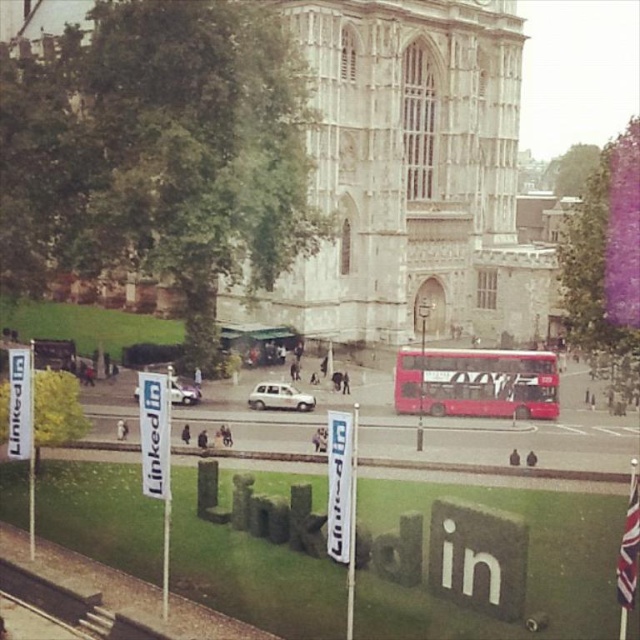
You are a delivery person trying to park your white matte car at center between two vehicles. The space between the silver metallic van at center and another vehicle is 1.8 meters. Can your car fit?

The white matte car at center is thinner than the silver metallic van at center. Since the space between the vehicles is 1.8 meters, and the car is thinner, it should fit as long as its width is less than 1.8 meters.

You are a photographer planning to take a picture of the historic stone building. You notice a white matte car at center and a silver metallic van at center in the foreground. Which vehicle should you avoid including in your shot to ensure the building remains the main focus, considering their sizes?

The silver metallic van at center is taller than the white matte car at center. To keep the building as the main focus, avoid including the taller silver metallic van at center in the shot.